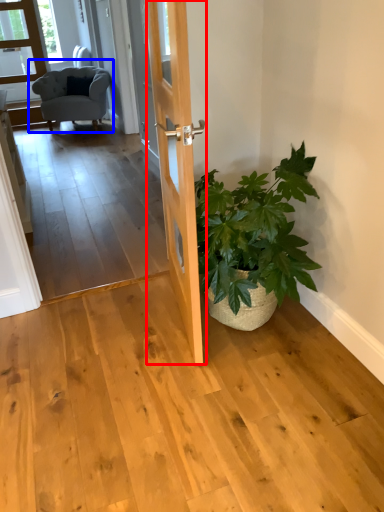
Question: Which object appears closest to the camera in this image, door (highlighted by a red box) or chair (highlighted by a blue box)?

Choices:
 (A) door
 (B) chair

Answer: (A)